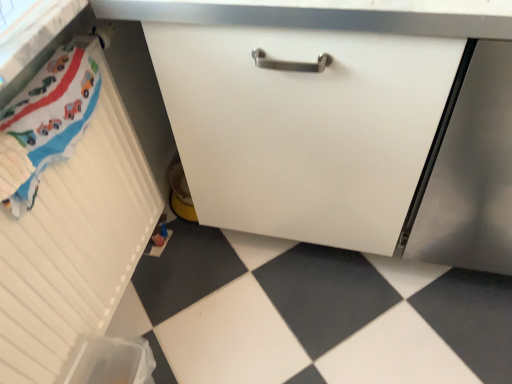
This screenshot has width=512, height=384. What are the coordinates of `vacant area situated below satin silver screen door at lower right (from a real-world perspective)` in the screenshot? It's located at (459, 230).